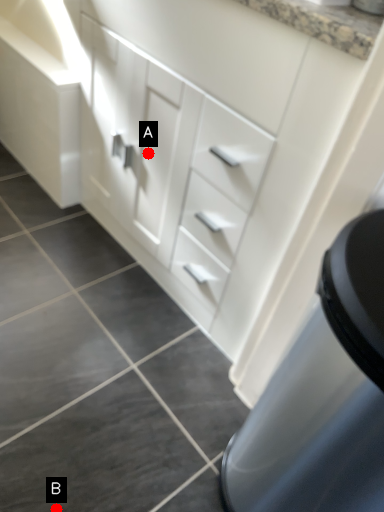
Question: Two points are circled on the image, labeled by A and B beside each circle. Which point is closer to the camera taking this photo?

Choices:
 (A) A is closer
 (B) B is closer

Answer: (B)